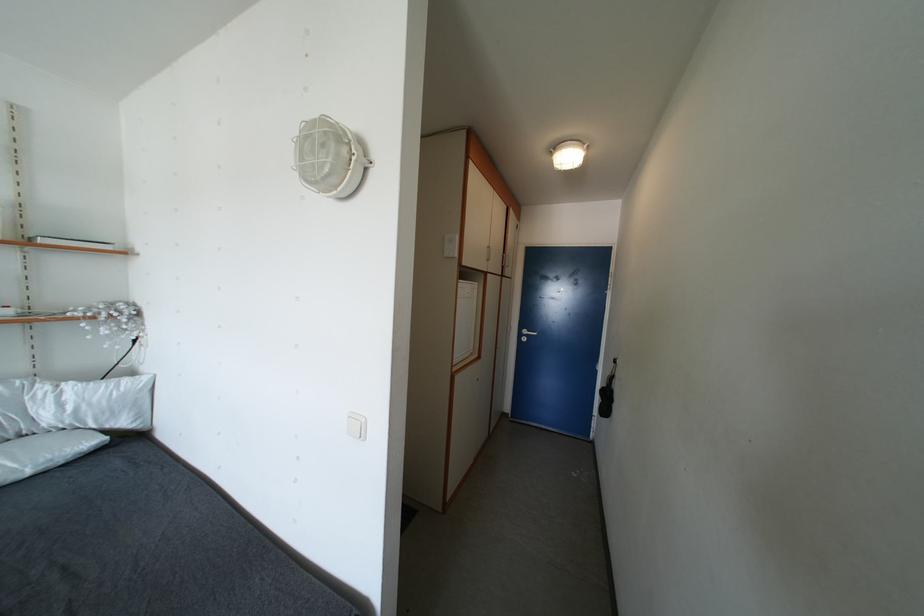
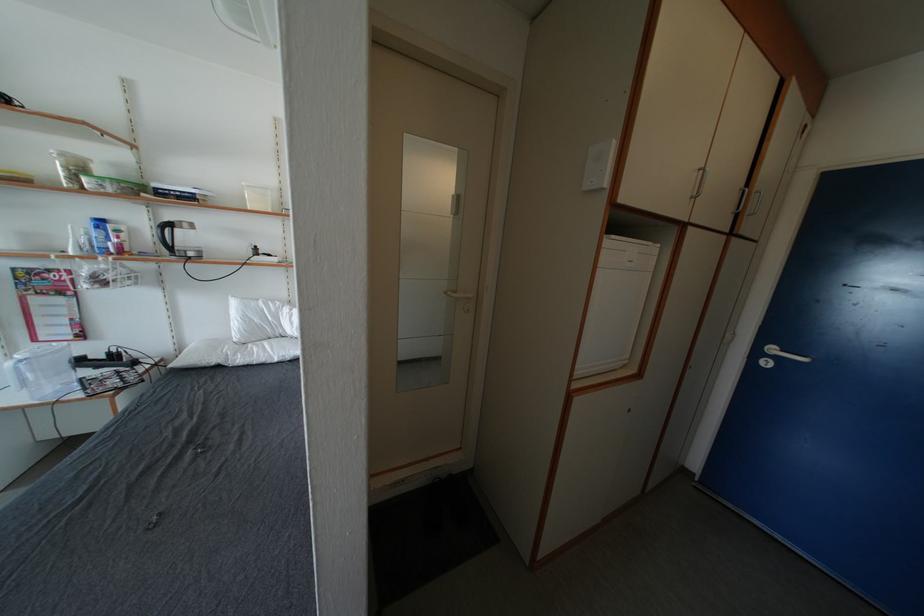
Question: Based on the continuous images, in which direction is the camera rotating? Reply with the corresponding letter.

Choices:
 (A) Left
 (B) Right
 (C) Up
 (D) Down

Answer: (A)